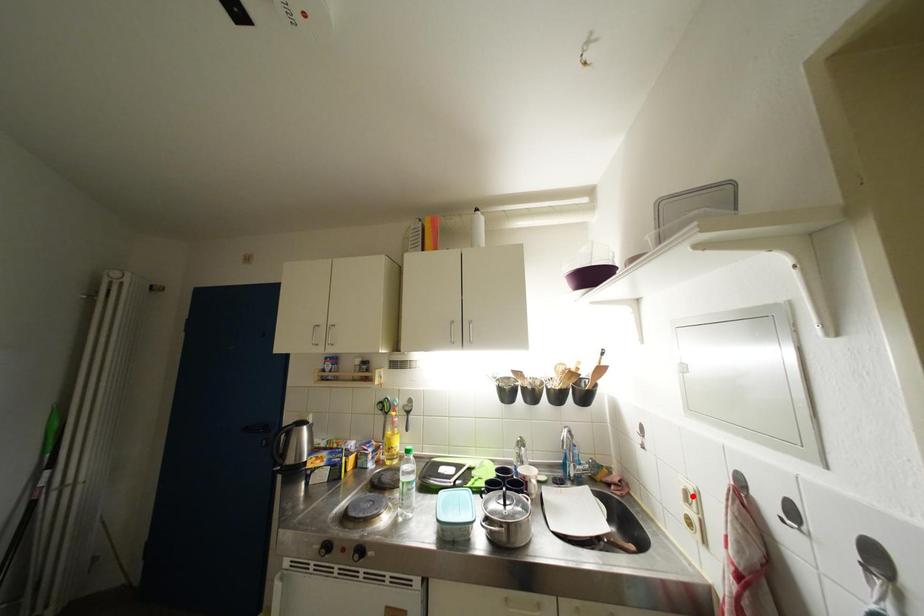
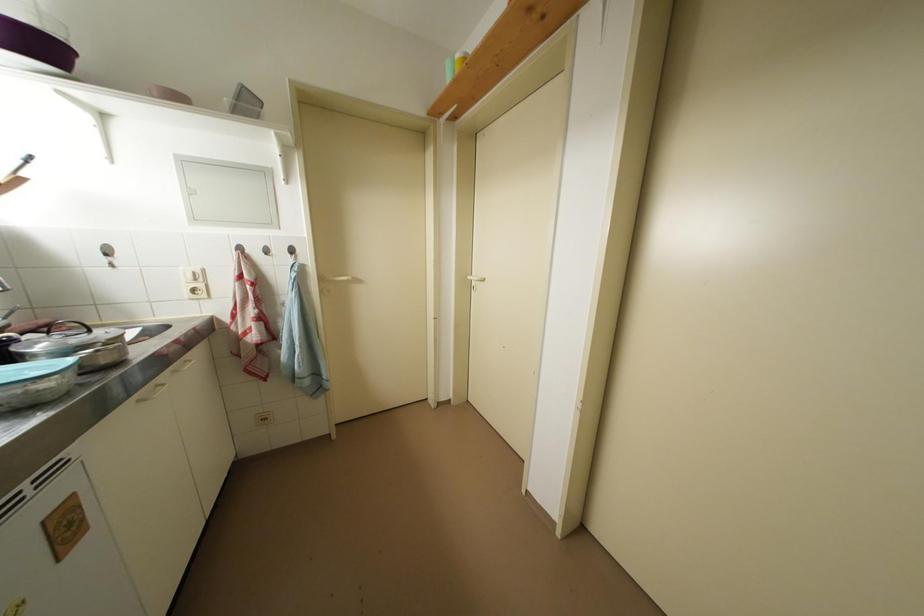
Locate, in the second image, the point that corresponds to the highlighted location in the first image.

(201, 277)